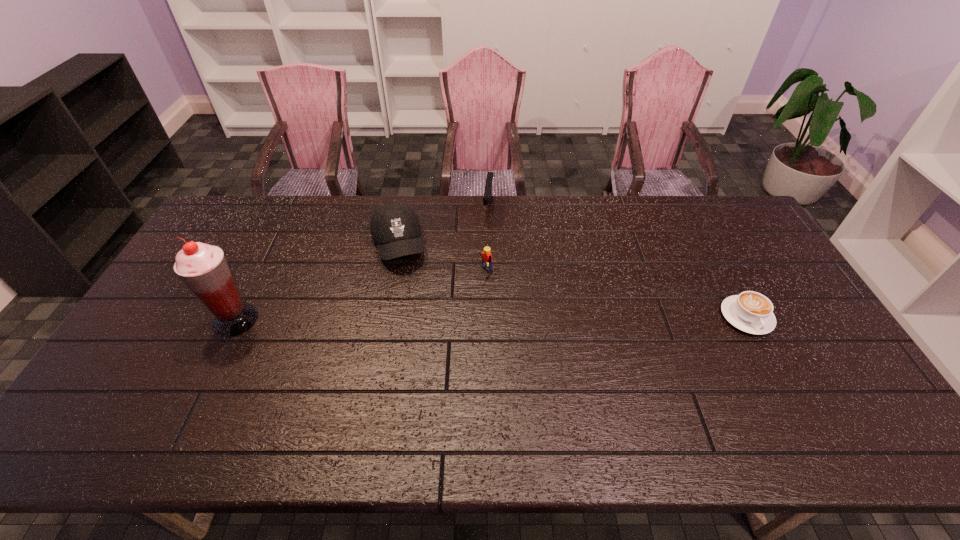
Locate an element on the screen. object that is at the right edge is located at coordinates (751, 312).

At what (x,y) coordinates should I click in order to perform the action: click on vacant space at the far edge of the desktop. Please return your answer as a coordinate pair (x, y). The width and height of the screenshot is (960, 540). Looking at the image, I should click on (467, 221).

Identify the location of vacant space at the near edge of the desktop. This screenshot has width=960, height=540. (495, 408).

Locate an element on the screen. This screenshot has height=540, width=960. vacant area at the left edge is located at coordinates [x=165, y=309].

Where is `free location at the right edge of the desktop`? This screenshot has height=540, width=960. free location at the right edge of the desktop is located at coordinates (775, 264).

Image resolution: width=960 pixels, height=540 pixels. Find the location of `free spot at the far left corner of the desktop`. free spot at the far left corner of the desktop is located at coordinates (243, 200).

Image resolution: width=960 pixels, height=540 pixels. I want to click on vacant space at the near right corner of the desktop, so click(x=839, y=407).

Locate an element on the screen. unoccupied area between the pistol and the cappuccino is located at coordinates (617, 263).

Where is `free space that is in between the fourth object from right to left and the pistol`? The height and width of the screenshot is (540, 960). free space that is in between the fourth object from right to left and the pistol is located at coordinates (444, 227).

The height and width of the screenshot is (540, 960). Find the location of `empty space between the cappuccino and the baseball cap`. empty space between the cappuccino and the baseball cap is located at coordinates (572, 281).